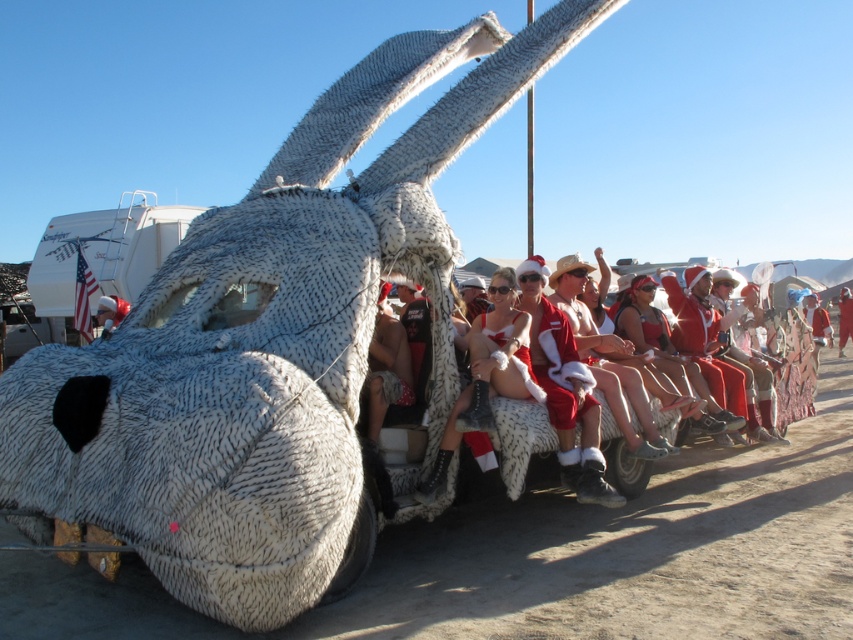
Question: Which is nearer to the matte white helmet at center?

Choices:
 (A) white fur coat at center
 (B) red santa suit at center

Answer: (A)

Question: From the image, what is the correct spatial relationship of white fur coat at center in relation to red santa suit at center?

Choices:
 (A) below
 (B) above

Answer: (A)

Question: Which object is farther from the camera taking this photo?

Choices:
 (A) matte white helmet at center
 (B) red santa suit at center

Answer: (B)

Question: Based on their relative distances, which object is nearer to the white fur coat at center?

Choices:
 (A) matte white helmet at center
 (B) red santa suit at center

Answer: (A)

Question: Considering the relative positions of white fur coat at center and red santa suit at center in the image provided, where is white fur coat at center located with respect to red santa suit at center?

Choices:
 (A) below
 (B) above

Answer: (A)

Question: Considering the relative positions of white fur coat at center and red santa suit at center in the image provided, where is white fur coat at center located with respect to red santa suit at center?

Choices:
 (A) right
 (B) left

Answer: (B)